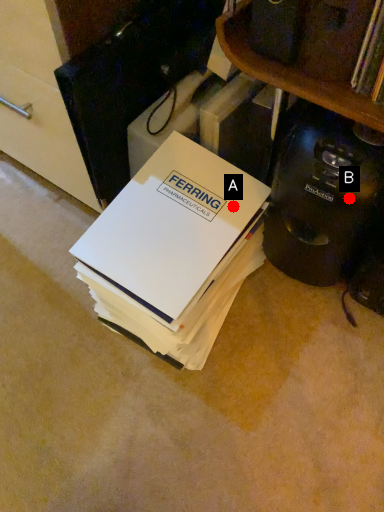
Question: Two points are circled on the image, labeled by A and B beside each circle. Which point appears closest to the camera in this image?

Choices:
 (A) A is closer
 (B) B is closer

Answer: (B)